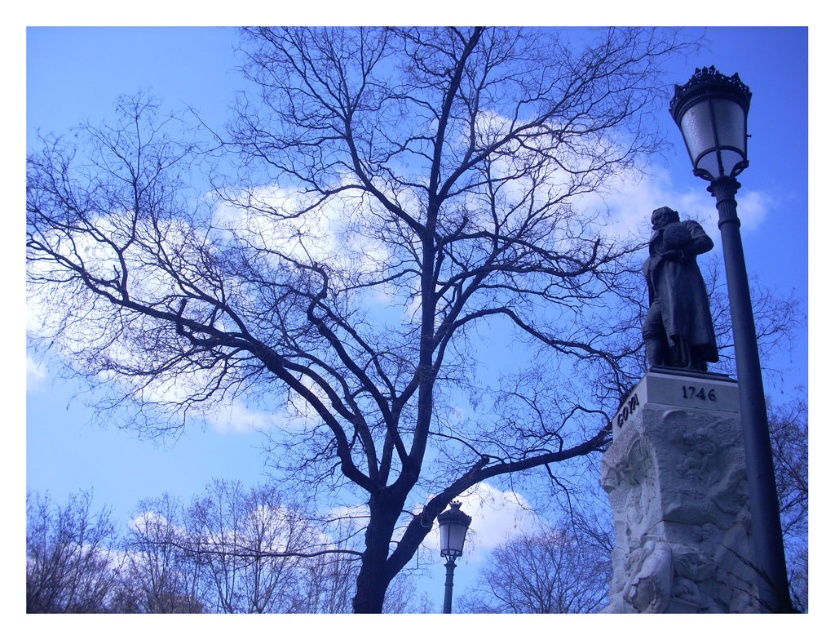
Question: Estimate the real-world distances between objects in this image. Which object is closer to the bare branches at lower left?

Choices:
 (A) metallic streetlight at center
 (B) bronze statue at upper right

Answer: (A)

Question: Which object is farther from the camera taking this photo?

Choices:
 (A) bare branches at lower left
 (B) bare branches at center

Answer: (A)

Question: Can you confirm if bare branches at lower left is positioned to the right of metallic streetlight at center?

Choices:
 (A) yes
 (B) no

Answer: (B)

Question: From the image, what is the correct spatial relationship of bronze statue at upper right in relation to metallic streetlight at center?

Choices:
 (A) below
 (B) above

Answer: (B)

Question: Is polished brass street light at right thinner than metallic streetlight at center?

Choices:
 (A) yes
 (B) no

Answer: (B)

Question: Which point is closer to the camera taking this photo?

Choices:
 (A) (704, 116)
 (B) (100, 525)
 (C) (658, 228)
 (D) (552, 572)

Answer: (A)